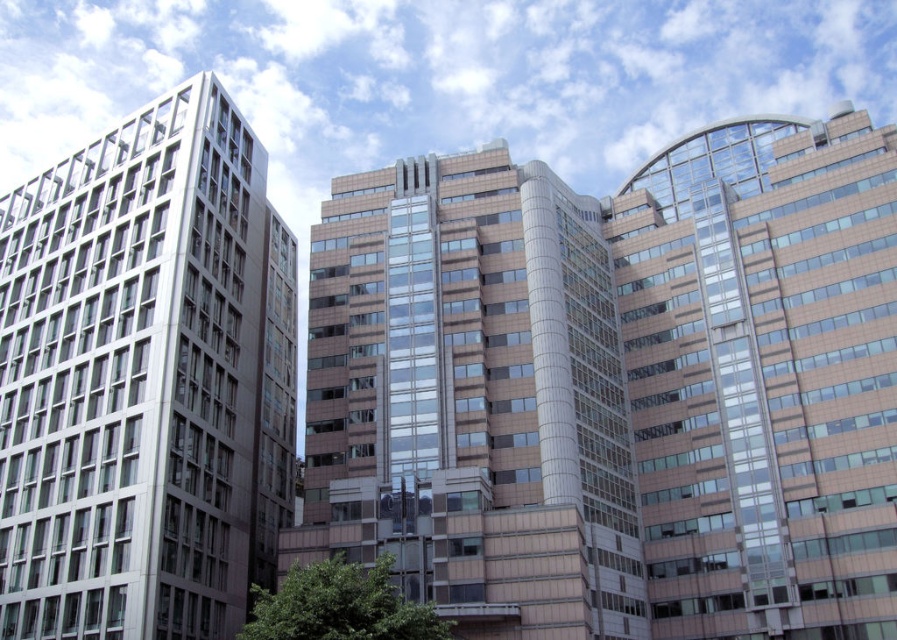
Question: Which is farther from the beige glass building at center?

Choices:
 (A) metallic glass building at left
 (B) matte glass building at right

Answer: (A)

Question: Is beige glass building at center thinner than matte glass building at right?

Choices:
 (A) yes
 (B) no

Answer: (B)

Question: Does beige glass building at center appear over matte glass building at right?

Choices:
 (A) no
 (B) yes

Answer: (A)

Question: Which object appears farthest from the camera in this image?

Choices:
 (A) matte glass building at right
 (B) beige glass building at center
 (C) metallic glass building at left

Answer: (A)

Question: Which point is farther from the camera taking this photo?

Choices:
 (A) (190, 356)
 (B) (662, 170)
 (C) (542, 588)

Answer: (B)

Question: From the image, what is the correct spatial relationship of metallic glass building at left in relation to beige glass building at center?

Choices:
 (A) below
 (B) above

Answer: (A)